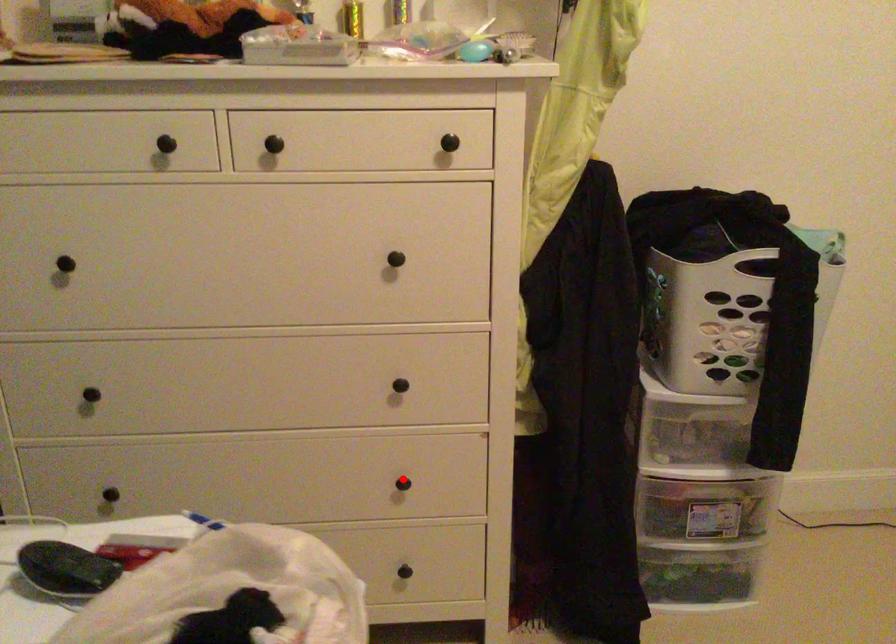
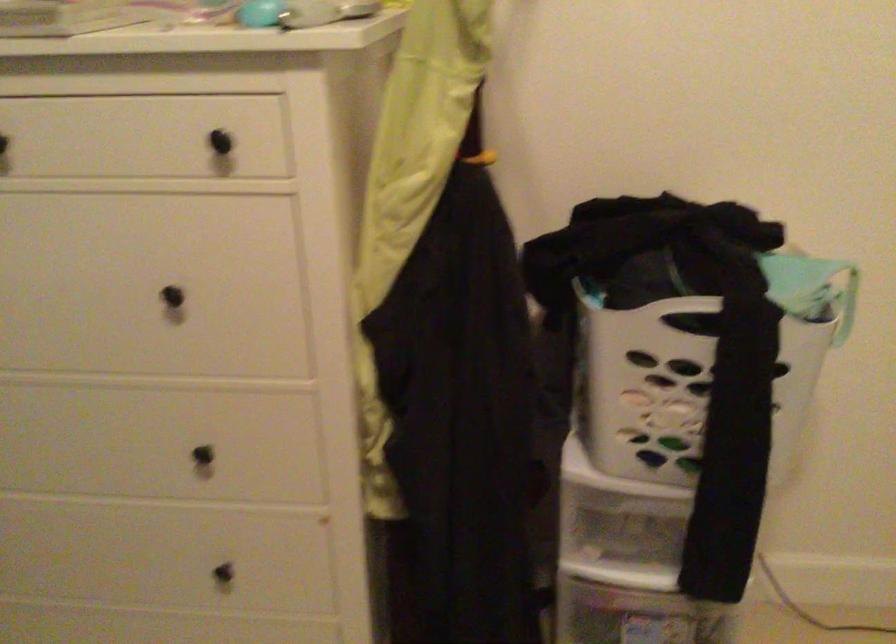
Locate, in the second image, the point that corresponds to the highlighted location in the first image.

(226, 564)